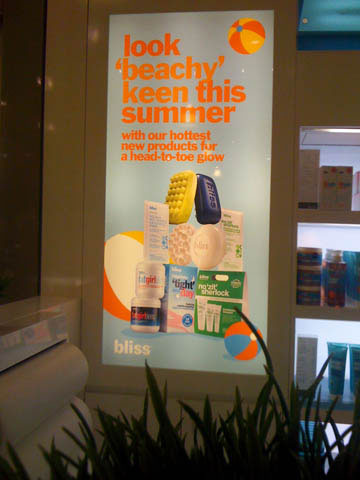
Locate an element on the screen. potted plant is located at coordinates (196, 471).